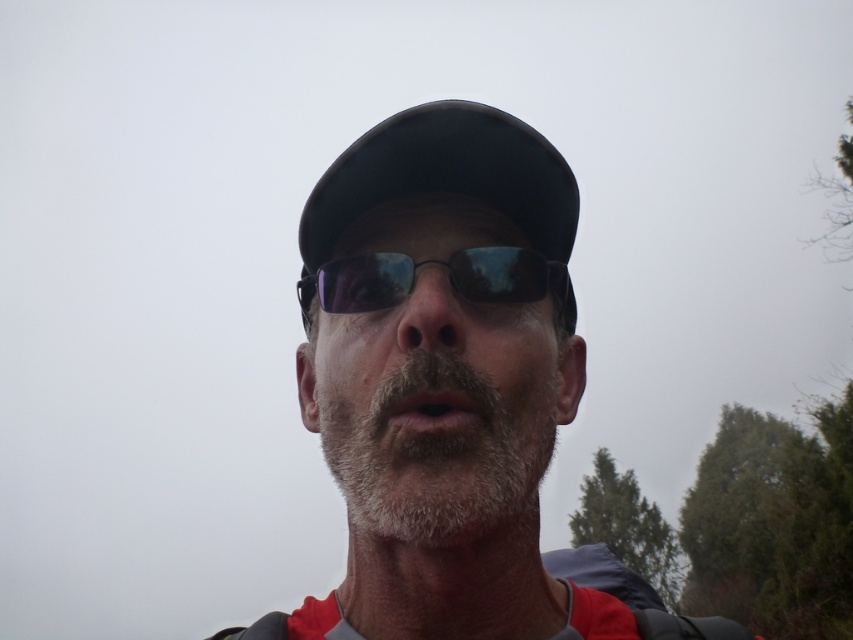
Is matte black cap at center closer to camera compared to graywoollybeard at center?

That is False.

Is point (508, 625) less distant than point (508, 452)?

No, (508, 625) is further to viewer.

Between point (454, 515) and point (506, 416), which one is positioned behind?

The point (506, 416) is more distant.

You are a GUI agent. You are given a task and a screenshot of the screen. Output one action in this format:
    pyautogui.click(x=<x>, y=<y>)
    Task: Click on the matte black cap at center
    
    Given the screenshot: What is the action you would take?
    pyautogui.click(x=450, y=388)

Can you confirm if matte black cap at center is taller than black reflective sunglasses at center?

Correct, matte black cap at center is much taller as black reflective sunglasses at center.

Does matte black cap at center have a lesser height compared to black reflective sunglasses at center?

Incorrect, matte black cap at center's height does not fall short of black reflective sunglasses at center's.

The height and width of the screenshot is (640, 853). Describe the element at coordinates (450, 388) in the screenshot. I see `matte black cap at center` at that location.

Image resolution: width=853 pixels, height=640 pixels. I want to click on matte black cap at center, so click(x=450, y=388).

Is black matte baseball hat at center shorter than black reflective sunglasses at center?

No.

Looking at this image, how far apart are black matte baseball hat at center and black reflective sunglasses at center?

The distance of black matte baseball hat at center from black reflective sunglasses at center is 2.29 inches.

At what (x,y) coordinates should I click in order to perform the action: click on black matte baseball hat at center. Please return your answer as a coordinate pair (x, y). This screenshot has width=853, height=640. Looking at the image, I should click on (445, 176).